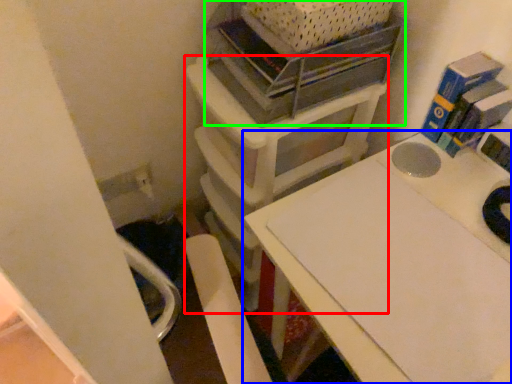
Question: Which object is the closest to the furniture (highlighted by a red box)? Choose among these: table (highlighted by a blue box) or shelf (highlighted by a green box).

Choices:
 (A) table
 (B) shelf

Answer: (B)